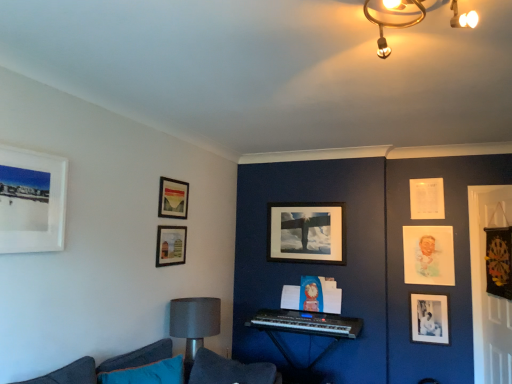
Question: From the image's perspective, is white matte picture frame at upper left, placed as the first picture frame when sorted from left to right, positioned above or below matte glass picture frame at upper center, which appears as the sixth picture frame when viewed from the back?

Choices:
 (A) above
 (B) below

Answer: (A)

Question: In the image, is white matte picture frame at upper left, which appears as the eighth picture frame when viewed from the back, positioned in front of or behind matte glass picture frame at upper center, which appears as the sixth picture frame when viewed from the back?

Choices:
 (A) front
 (B) behind

Answer: (A)

Question: Based on their relative distances, which object is farther from the white paper at upper right, which is the seventh picture frame in left-to-right order?

Choices:
 (A) gold metallic chandelier at upper center
 (B) black plastic keyboard at center
 (C) matte black picture frame at upper left, which is counted as the 5th picture frame, starting from the back
 (D) white matte picture frame at upper left, which appears as the 8th picture frame when viewed from the right
 (E) matte gray table lamp at lower left

Answer: (D)

Question: Considering the real-world distances, which object is closest to the matte gray table lamp at lower left?

Choices:
 (A) matte glass picture frame at upper center, acting as the 3th picture frame starting from the front
 (B) pastel paper portrait at right, the 6th picture frame from the front
 (C) white paper at upper right, which is the 2th picture frame in back-to-front order
 (D) matte wooden picture frame at center, the 4th picture frame in the left-to-right sequence
 (E) black plastic keyboard at center

Answer: (A)